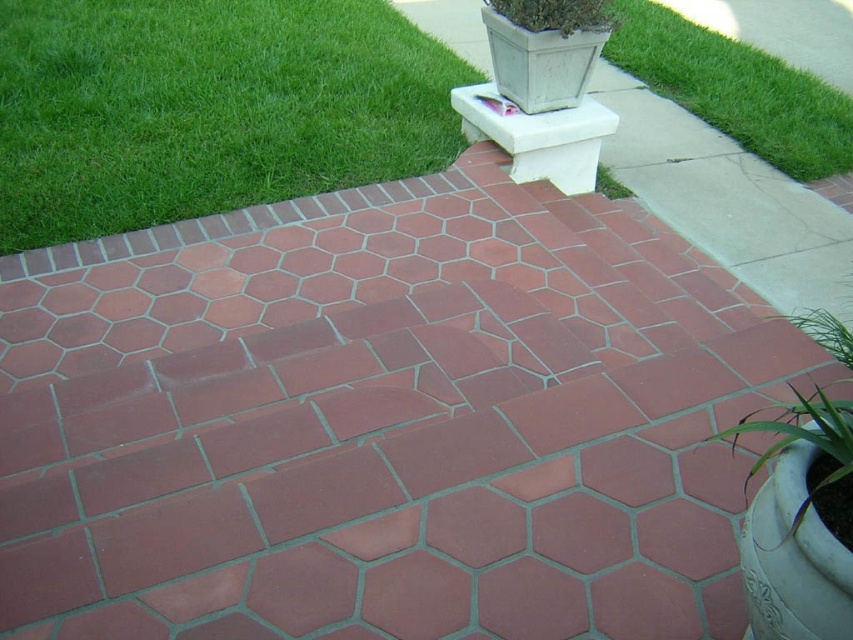
You are designing a garden layout and need to know the relative sizes of the green grass at upper left and the green leafy plant at lower right. Which one has a greater width?

The green grass at upper left has a greater width than the green leafy plant at lower right according to the description.

You are standing at the center of the patio. You want to walk to the green grass at upper left. Which direction should you move in?

You should move towards the upper left direction to reach the green grass at upper left since it is located at point (207,108).

You are designing a garden layout and need to place a new decorative stone. The stone requires a space wider than the green leafy plant at lower right. Can the green grass at upper right provide enough space for this?

The green grass at upper right has a larger width than the green leafy plant at lower right, so it can provide enough space for the decorative stone requiring a width larger than the plant.